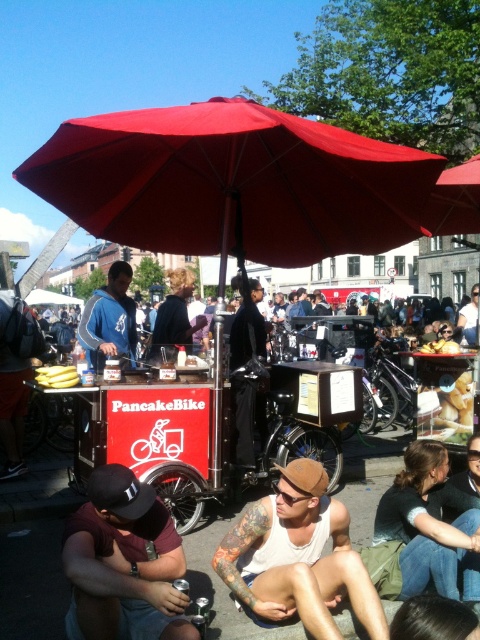
You are a customer at the PancakeBike food cart. You notice the red fabric umbrella at center and the white tank top at center. Which object is positioned to the right side from your perspective?

The white tank top at center is positioned to the right side of the red fabric umbrella at center.

Consider the image. You are a customer at the PancakeBike cart and need to ask the person in the maroon fabric shirt at lower left and the person in the blue fleece jacket at center about the menu. Which of the two people should you approach first based on their positions?

You should approach the blue fleece jacket at center first because the maroon fabric shirt at lower left is to the right of blue fleece jacket at center, meaning the blue fleece jacket at center is closer to your current position.